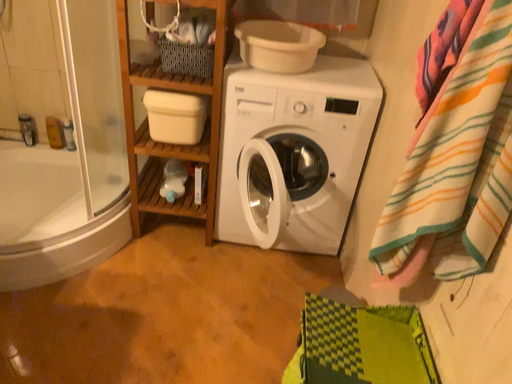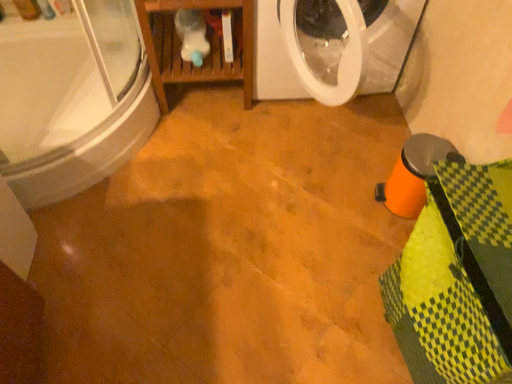
Question: Which way did the camera rotate in the video?

Choices:
 (A) rotated upward
 (B) rotated downward

Answer: (B)